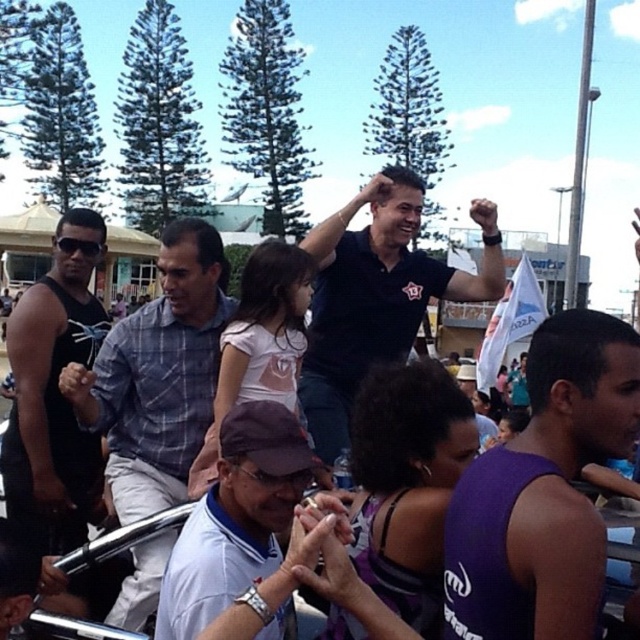
Is purple sleeveless shirt at center shorter than black matte tank top at left?

Indeed, purple sleeveless shirt at center has a lesser height compared to black matte tank top at left.

Identify the location of purple sleeveless shirt at center. The height and width of the screenshot is (640, 640). (544, 492).

Does point (586, 449) lie in front of point (13, 477)?

Yes, point (586, 449) is in front of point (13, 477).

I want to click on purple sleeveless shirt at center, so coord(544,492).

Who is taller, blue plaid shirt at center or black matte tank top at left?

With more height is black matte tank top at left.

Consider the image. Who is lower down, blue plaid shirt at center or black matte tank top at left?

blue plaid shirt at center is lower down.

Where is `blue plaid shirt at center`? This screenshot has width=640, height=640. blue plaid shirt at center is located at coordinates (157, 374).

Who is shorter, white matte cap at center or black matte tank top at left?

Standing shorter between the two is white matte cap at center.

Does white matte cap at center appear under black matte tank top at left?

Indeed, white matte cap at center is positioned under black matte tank top at left.

At what (x,y) coordinates should I click in order to perform the action: click on white matte cap at center. Please return your answer as a coordinate pair (x, y). The height and width of the screenshot is (640, 640). Looking at the image, I should click on (244, 532).